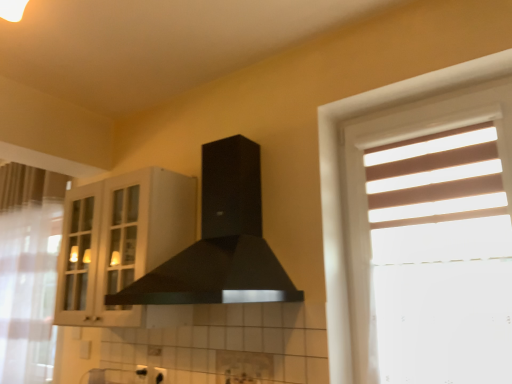
Question: Is white sheer curtain at left closer to camera compared to black matte fume hood at center?

Choices:
 (A) yes
 (B) no

Answer: (B)

Question: From the image's perspective, is white sheer curtain at left below black matte fume hood at center?

Choices:
 (A) yes
 (B) no

Answer: (A)

Question: Does white sheer curtain at left touch black matte fume hood at center?

Choices:
 (A) no
 (B) yes

Answer: (A)

Question: Is white sheer curtain at left not within black matte fume hood at center?

Choices:
 (A) yes
 (B) no

Answer: (A)

Question: Is black matte fume hood at center a part of white sheer curtain at left?

Choices:
 (A) no
 (B) yes

Answer: (A)

Question: Is white sheer curtain at left bigger than black matte fume hood at center?

Choices:
 (A) no
 (B) yes

Answer: (A)

Question: Does black matte fume hood at center lie behind clear glass screen door at left?

Choices:
 (A) no
 (B) yes

Answer: (A)

Question: Does black matte fume hood at center have a greater height compared to clear glass screen door at left?

Choices:
 (A) no
 (B) yes

Answer: (A)

Question: Would you say black matte fume hood at center is outside clear glass screen door at left?

Choices:
 (A) yes
 (B) no

Answer: (A)

Question: From a real-world perspective, is black matte fume hood at center located higher than clear glass screen door at left?

Choices:
 (A) yes
 (B) no

Answer: (B)

Question: Can you confirm if black matte fume hood at center is bigger than clear glass screen door at left?

Choices:
 (A) no
 (B) yes

Answer: (B)

Question: From a real-world perspective, is black matte fume hood at center physically below clear glass screen door at left?

Choices:
 (A) no
 (B) yes

Answer: (B)

Question: Does clear glass screen door at left have a larger size compared to white glass cabinet at upper left?

Choices:
 (A) no
 (B) yes

Answer: (A)